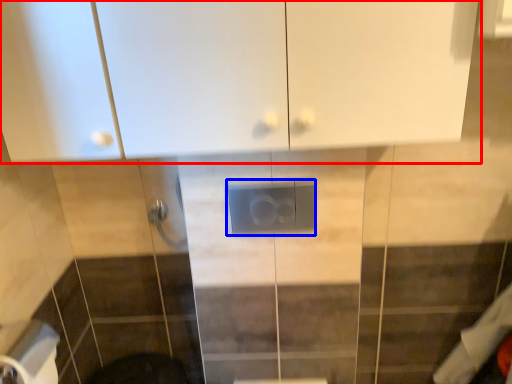
Question: Which point is closer to the camera, cabinetry (highlighted by a red box) or electric outlet (highlighted by a blue box)?

Choices:
 (A) cabinetry
 (B) electric outlet

Answer: (A)